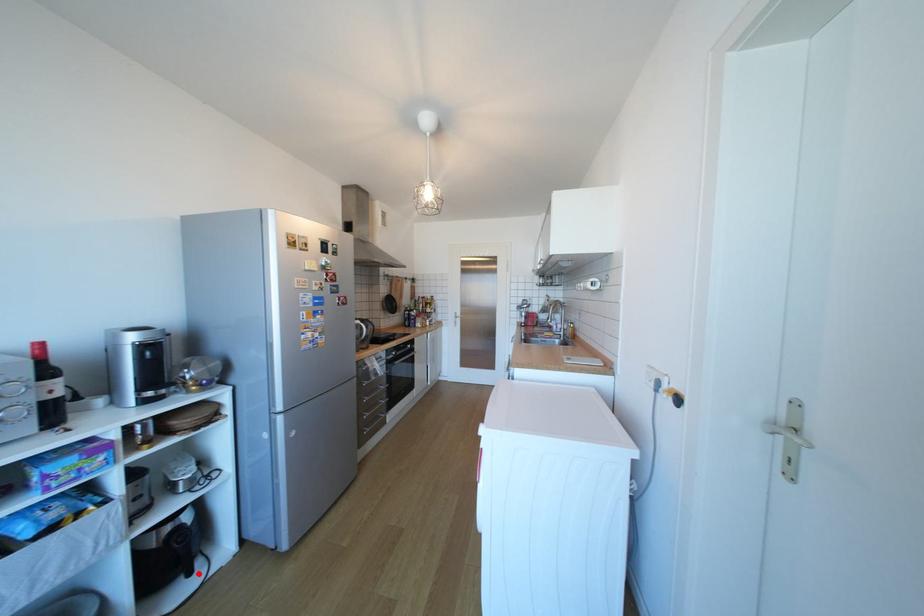
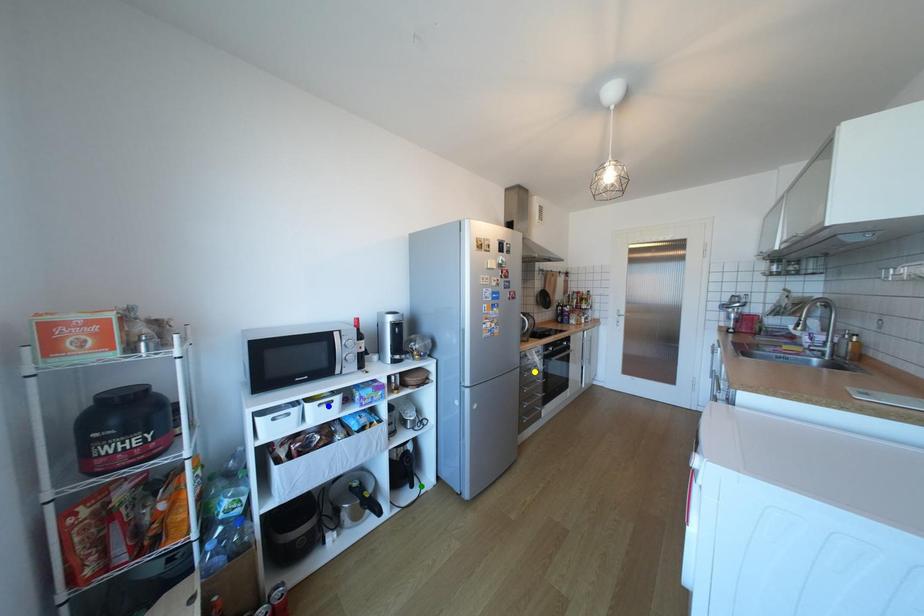
Question: I am providing you with two images of the same scene from different viewpoints. A red point is marked on the first image. You are given multiple points on the second image. Which spot in image 2 lines up with the point in image 1?

Choices:
 (A) blue point
 (B) green point
 (C) yellow point

Answer: (B)